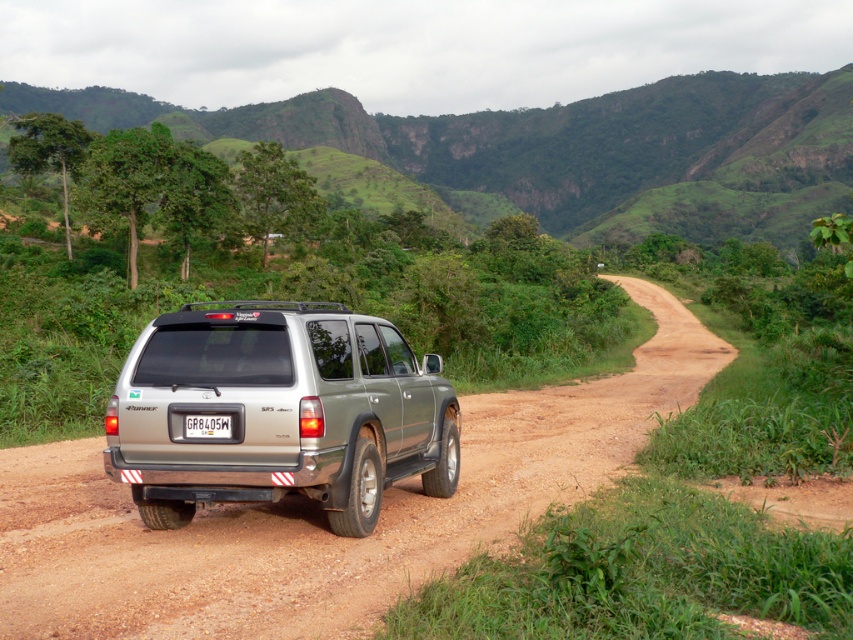
Does green grassy hillside at upper center appear on the right side of satin silver suv at center?

In fact, green grassy hillside at upper center is to the left of satin silver suv at center.

Which is below, green grassy hillside at upper center or satin silver suv at center?

Positioned lower is satin silver suv at center.

Where is `green grassy hillside at upper center`? green grassy hillside at upper center is located at coordinates (569, 148).

Is satin silver suv at center to the right of white plastic license plate at rear from the viewer's perspective?

No, satin silver suv at center is not to the right of white plastic license plate at rear.

Which is in front, point (339, 330) or point (184, 419)?

Point (184, 419) is in front.

Where is `satin silver suv at center`? satin silver suv at center is located at coordinates (277, 412).

Does green grassy hillside at upper center appear over white plastic license plate at rear?

Indeed, green grassy hillside at upper center is positioned over white plastic license plate at rear.

Between point (821, 93) and point (193, 420), which one is positioned behind?

The point (821, 93) is more distant.

Between point (614, 99) and point (192, 429), which one is positioned in front?

Positioned in front is point (192, 429).

Where is `green grassy hillside at upper center`? green grassy hillside at upper center is located at coordinates (569, 148).